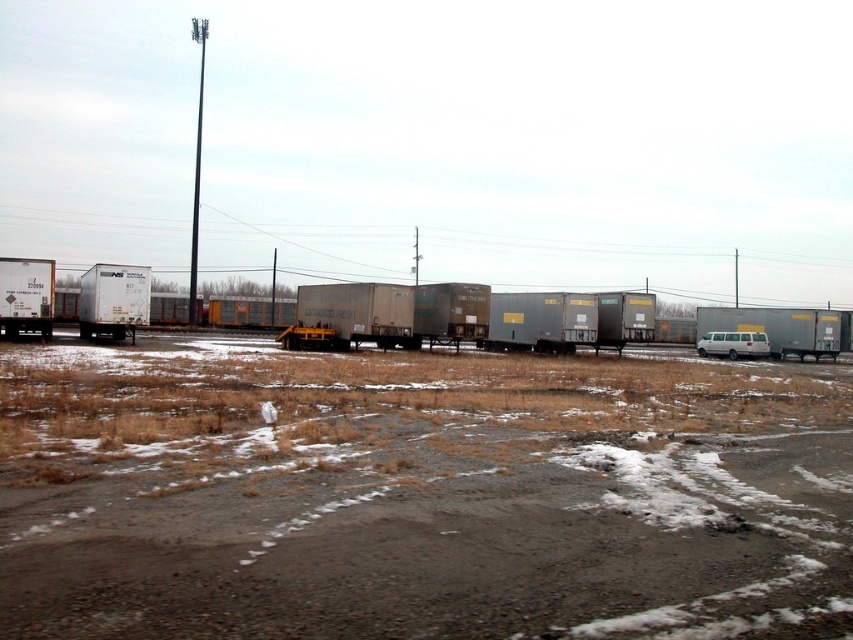
Consider the image. Is gray matte freight car at center positioned behind white matte trailer truck at left?

No, gray matte freight car at center is in front of white matte trailer truck at left.

Does gray matte freight car at center have a greater height compared to white matte trailer truck at left?

Indeed, gray matte freight car at center has a greater height compared to white matte trailer truck at left.

Which is behind, point (15, 275) or point (126, 269)?

The point (126, 269) is more distant.

Identify the location of gray matte freight car at center. (517, 314).

Which of these two, silver metallic trailer truck at right or white matte trailer truck at left, stands taller?

With more height is white matte trailer truck at left.

Which is behind, point (850, 336) or point (117, 337)?

Positioned behind is point (850, 336).

In order to click on silver metallic trailer truck at right in this screenshot , I will do `click(782, 328)`.

Which is behind, point (815, 308) or point (711, 326)?

Positioned behind is point (711, 326).

Based on the photo, is gray matte freight car at center taller than silver metallic trailer truck at right?

Yes, gray matte freight car at center is taller than silver metallic trailer truck at right.

Locate an element on the screen. gray matte freight car at center is located at coordinates (517, 314).